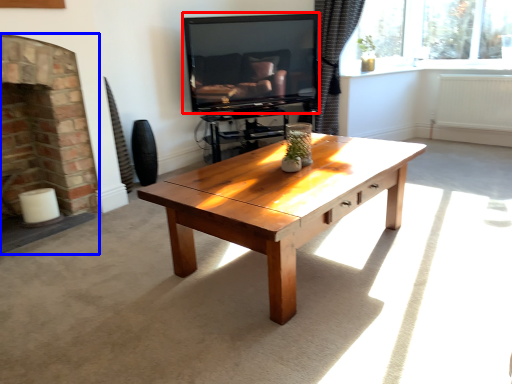
Question: Which point is closer to the camera, television (highlighted by a red box) or fireplace (highlighted by a blue box)?

Choices:
 (A) television
 (B) fireplace

Answer: (B)